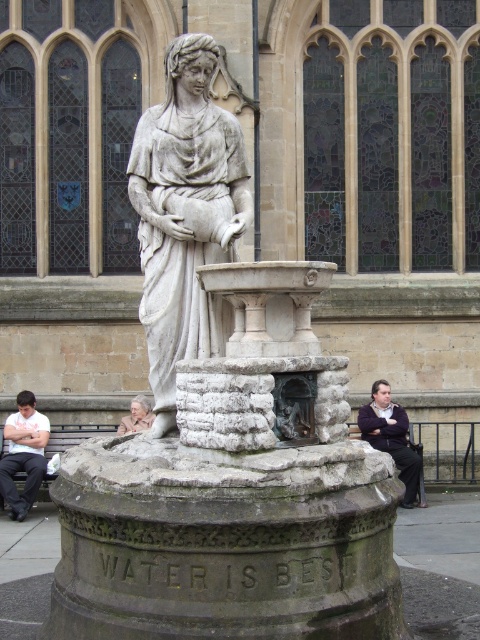
Question: Is white cotton shirt at lower left positioned before light beige stone statue at center?

Choices:
 (A) yes
 (B) no

Answer: (A)

Question: Which object is positioned closest to the white stone statue at center?

Choices:
 (A) white cotton shirt at lower left
 (B) light beige stone statue at center
 (C) dark brown leather jacket at lower right

Answer: (A)

Question: Among these objects, which one is farthest from the camera?

Choices:
 (A) light beige stone statue at center
 (B) white stone statue at center

Answer: (A)

Question: Is white cotton shirt at lower left wider than light beige stone statue at center?

Choices:
 (A) no
 (B) yes

Answer: (B)

Question: Does white stone statue at center have a larger size compared to white cotton shirt at lower left?

Choices:
 (A) no
 (B) yes

Answer: (A)

Question: Which point is closer to the camera?

Choices:
 (A) white cotton shirt at lower left
 (B) dark brown leather jacket at lower right
 (C) light beige stone statue at center

Answer: (A)